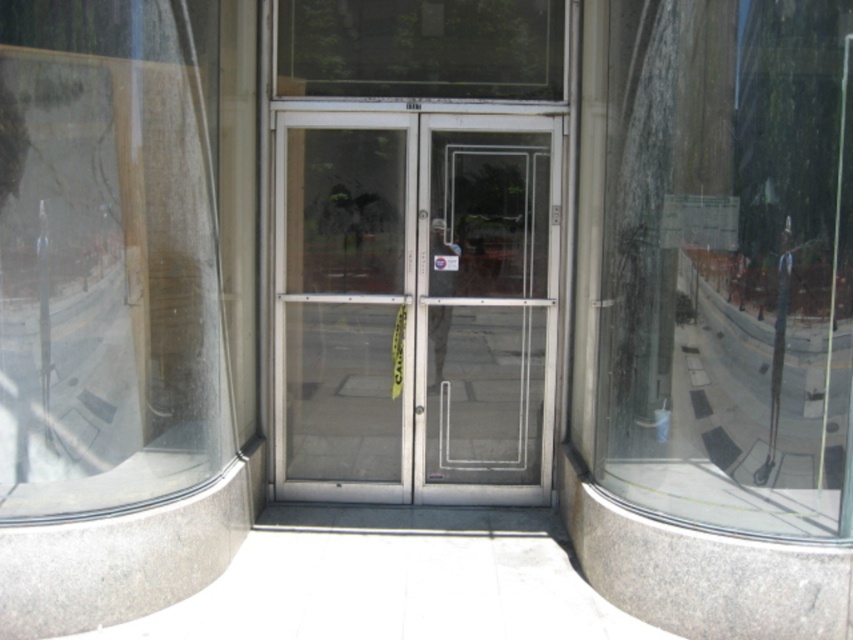
You are standing in front of the double glass doors and want to check if there is a transparent glass window at left at point (107,259). Is there a transparent glass window at left at that coordinate?

Yes, the transparent glass window at left is located at point (107,259).

You are a delivery person trying to hand over a package to the receptionist inside. The transparent glass window at center and the transparent glass door at center are both in front of you. Which one should you approach to deliver the package?

You should approach the transparent glass door at center because the transparent glass window at center has a lesser width compared to the transparent glass door at center, making the door wider and more accessible for delivering the package.

Consider the image. You are a delivery person trying to hand over a package to the recipient inside the building. You see the transparent glass window at left and the transparent glass door at center. Which object allows you to pass through to enter the building?

The transparent glass door at center allows you to pass through to enter the building because the transparent glass window at left is located above it and windows typically do not open for entry.